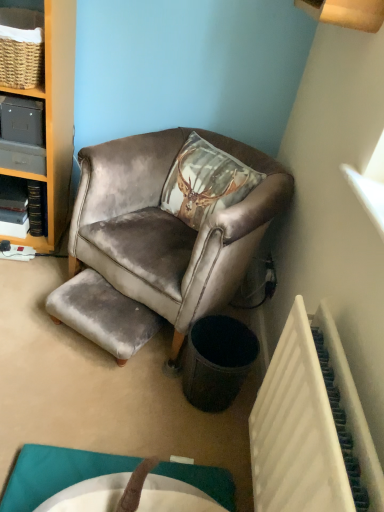
The image size is (384, 512). Describe the element at coordinates (168, 226) in the screenshot. I see `velvet brown armchair at center` at that location.

This screenshot has width=384, height=512. What are the coordinates of `black textured trash bin at lower right` in the screenshot? It's located at (x=217, y=361).

Describe the element at coordinates (217, 361) in the screenshot. I see `black textured trash bin at lower right` at that location.

What is the approximate width of white plastic radiator at lower right?

9.12 centimeters.

What is the approximate height of white plastic radiator at lower right?

white plastic radiator at lower right is 22.10 inches tall.

Where is `velvet brown armchair at center`? velvet brown armchair at center is located at coordinates (168, 226).

Between matte gray cabinet at left and black textured trash bin at lower right, which one is positioned behind?

matte gray cabinet at left.

You are a GUI agent. You are given a task and a screenshot of the screen. Output one action in this format:
    pyautogui.click(x=<x>, y=<y>)
    Task: Click on the shelf above the black textured trash bin at lower right (from the image's perspective)
    Image resolution: width=384 pixels, height=512 pixels.
    Given the screenshot: What is the action you would take?
    pyautogui.click(x=22, y=134)

Who is taller, matte gray cabinet at left or black textured trash bin at lower right?

black textured trash bin at lower right.

Is black textured trash bin at lower right at the back of matte gray cabinet at left?

No, matte gray cabinet at left is not facing the opposite direction of black textured trash bin at lower right.

Can you confirm if white plastic radiator at lower right is thinner than matte gray cabinet at left?

Yes, white plastic radiator at lower right is thinner than matte gray cabinet at left.

Is white plastic radiator at lower right looking in the opposite direction of matte gray cabinet at left?

No, white plastic radiator at lower right is not facing away from matte gray cabinet at left.

Considering the relative sizes of white plastic radiator at lower right and matte gray cabinet at left in the image provided, is white plastic radiator at lower right taller than matte gray cabinet at left?

Yes, white plastic radiator at lower right is taller than matte gray cabinet at left.

Measure the distance from white plastic radiator at lower right to matte gray cabinet at left.

4.58 feet.

Can you tell me how much matte gray cabinet at left and white plastic radiator at lower right differ in facing direction?

The angle between the facing direction of matte gray cabinet at left and the facing direction of white plastic radiator at lower right is 91.2 degrees.

From their relative heights in the image, would you say matte gray cabinet at left is taller or shorter than white plastic radiator at lower right?

matte gray cabinet at left is shorter than white plastic radiator at lower right.

Where is `shelf positioned vertically above the white plastic radiator at lower right (from a real-world perspective)`? Image resolution: width=384 pixels, height=512 pixels. shelf positioned vertically above the white plastic radiator at lower right (from a real-world perspective) is located at coordinates (22, 134).

Which object is further away from the camera, matte gray cabinet at left or white plastic radiator at lower right?

matte gray cabinet at left is more distant.

Considering the relative sizes of black textured trash bin at lower right and velvet brown armchair at center in the image provided, is black textured trash bin at lower right shorter than velvet brown armchair at center?

Indeed, black textured trash bin at lower right has a lesser height compared to velvet brown armchair at center.

Looking at this image, from a real-world perspective, which is physically below, black textured trash bin at lower right or velvet brown armchair at center?

black textured trash bin at lower right.

Is point (193, 381) closer to viewer compared to point (243, 146)?

Yes, point (193, 381) is closer to viewer.

Are black textured trash bin at lower right and velvet brown armchair at center beside each other?

black textured trash bin at lower right and velvet brown armchair at center are clearly separated.

Considering the sizes of velvet brown armchair at center and matte gray cabinet at left in the image, is velvet brown armchair at center bigger or smaller than matte gray cabinet at left?

velvet brown armchair at center is bigger than matte gray cabinet at left.

Based on the photo, between velvet brown armchair at center and matte gray cabinet at left, which one has more height?

velvet brown armchair at center is taller.

Consider the image. Can you confirm if velvet brown armchair at center is positioned to the right of matte gray cabinet at left?

Yes, velvet brown armchair at center is to the right of matte gray cabinet at left.

Looking at this image, how many degrees apart are the facing directions of white plastic radiator at lower right and black textured trash bin at lower right?

61 degrees separate the facing orientations of white plastic radiator at lower right and black textured trash bin at lower right.

Does white plastic radiator at lower right have a lesser height compared to black textured trash bin at lower right?

No, white plastic radiator at lower right is not shorter than black textured trash bin at lower right.

From a real-world perspective, which object rests below the other?

black textured trash bin at lower right, from a real-world perspective.

Is white plastic radiator at lower right bigger than black textured trash bin at lower right?

Indeed, white plastic radiator at lower right has a larger size compared to black textured trash bin at lower right.

Who is more distant, black textured trash bin at lower right or velvet grey stool at lower left?

Positioned behind is velvet grey stool at lower left.

Identify the location of trash bin/can that is above the velvet grey stool at lower left (from a real-world perspective). (217, 361).

Consider the image. Which object is positioned more to the right, black textured trash bin at lower right or velvet grey stool at lower left?

Positioned to the right is black textured trash bin at lower right.

Is black textured trash bin at lower right inside or outside of velvet grey stool at lower left?

black textured trash bin at lower right exists outside the volume of velvet grey stool at lower left.

The width and height of the screenshot is (384, 512). I want to click on shelf above the black textured trash bin at lower right (from a real-world perspective), so click(22, 134).

You are a GUI agent. You are given a task and a screenshot of the screen. Output one action in this format:
    pyautogui.click(x=<x>, y=<y>)
    Task: Click on the radiator directly beneath the matte gray cabinet at left (from a real-world perspective)
    
    Given the screenshot: What is the action you would take?
    point(312,425)

Considering their positions, is velvet brown armchair at center positioned further to matte gray cabinet at left than velvet grey stool at lower left?

velvet grey stool at lower left lies further to matte gray cabinet at left than the other object.

Looking at the image, which one is located further to velvet brown armchair at center, velvet grey stool at lower left or black textured trash bin at lower right?

black textured trash bin at lower right lies further to velvet brown armchair at center than the other object.

Which object lies nearer to the anchor point matte gray cabinet at left, velvet brown armchair at center or black textured trash bin at lower right?

velvet brown armchair at center.

Looking at this image, estimate the real-world distances between objects in this image. Which object is further from white plastic radiator at lower right, matte gray cabinet at left or velvet brown armchair at center?

Among the two, matte gray cabinet at left is located further to white plastic radiator at lower right.

Based on their spatial positions, is matte gray cabinet at left or black textured trash bin at lower right further from velvet grey stool at lower left?

matte gray cabinet at left is positioned further to the anchor velvet grey stool at lower left.

Which object lies further to the anchor point velvet grey stool at lower left, velvet brown armchair at center or white plastic radiator at lower right?

white plastic radiator at lower right lies further to velvet grey stool at lower left than the other object.

Looking at the image, which one is located closer to black textured trash bin at lower right, matte gray cabinet at left or white plastic radiator at lower right?

The object closer to black textured trash bin at lower right is white plastic radiator at lower right.

Considering their positions, is matte gray cabinet at left positioned closer to velvet brown armchair at center than velvet grey stool at lower left?

velvet grey stool at lower left lies closer to velvet brown armchair at center than the other object.

Find the location of a particular element. The width and height of the screenshot is (384, 512). chair positioned between white plastic radiator at lower right and matte gray cabinet at left from near to far is located at coordinates (168, 226).

The height and width of the screenshot is (512, 384). Find the location of `stool that lies between matte gray cabinet at left and black textured trash bin at lower right from top to bottom`. stool that lies between matte gray cabinet at left and black textured trash bin at lower right from top to bottom is located at coordinates (103, 314).

The height and width of the screenshot is (512, 384). Find the location of `chair between white plastic radiator at lower right and black textured trash bin at lower right in the front-back direction`. chair between white plastic radiator at lower right and black textured trash bin at lower right in the front-back direction is located at coordinates (168, 226).

Identify the location of trash bin/can positioned between white plastic radiator at lower right and velvet grey stool at lower left from near to far. (217, 361).